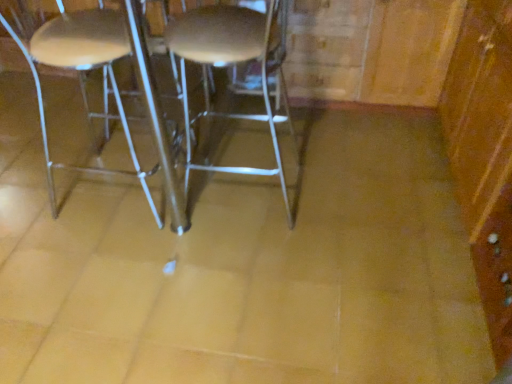
Question: From the image's perspective, is wooden dresser at right over metallic silver stool at center?

Choices:
 (A) no
 (B) yes

Answer: (B)

Question: Considering the relative sizes of wooden dresser at right and metallic silver stool at center in the image provided, is wooden dresser at right thinner than metallic silver stool at center?

Choices:
 (A) no
 (B) yes

Answer: (A)

Question: Is wooden dresser at right to the right of metallic silver stool at center from the viewer's perspective?

Choices:
 (A) yes
 (B) no

Answer: (A)

Question: From a real-world perspective, is wooden dresser at right on metallic silver stool at center?

Choices:
 (A) no
 (B) yes

Answer: (A)

Question: Is wooden dresser at right positioned far away from metallic silver stool at center?

Choices:
 (A) yes
 (B) no

Answer: (B)

Question: Considering the positions of metallic silver stool at center and metallic silver stool at left in the image, is metallic silver stool at center taller or shorter than metallic silver stool at left?

Choices:
 (A) short
 (B) tall

Answer: (A)

Question: Is point (265, 64) positioned closer to the camera than point (119, 39)?

Choices:
 (A) farther
 (B) closer

Answer: (A)

Question: From the image's perspective, is metallic silver stool at center positioned above or below metallic silver stool at left?

Choices:
 (A) below
 (B) above

Answer: (B)

Question: Considering the positions of metallic silver stool at center and metallic silver stool at left in the image, is metallic silver stool at center wider or thinner than metallic silver stool at left?

Choices:
 (A) thin
 (B) wide

Answer: (B)

Question: Considering the positions of point (466, 3) and point (157, 220), is point (466, 3) closer or farther from the camera than point (157, 220)?

Choices:
 (A) closer
 (B) farther

Answer: (B)

Question: From their relative heights in the image, would you say wooden dresser at right is taller or shorter than metallic silver stool at left?

Choices:
 (A) tall
 (B) short

Answer: (B)

Question: From a real-world perspective, is wooden dresser at right physically located above or below metallic silver stool at left?

Choices:
 (A) above
 (B) below

Answer: (B)

Question: Visually, is wooden dresser at right positioned to the left or to the right of metallic silver stool at left?

Choices:
 (A) right
 (B) left

Answer: (A)

Question: From the image's perspective, is metallic silver stool at center positioned above or below wooden dresser at right?

Choices:
 (A) below
 (B) above

Answer: (A)

Question: Which is correct: metallic silver stool at center is inside wooden dresser at right, or outside of it?

Choices:
 (A) outside
 (B) inside

Answer: (A)